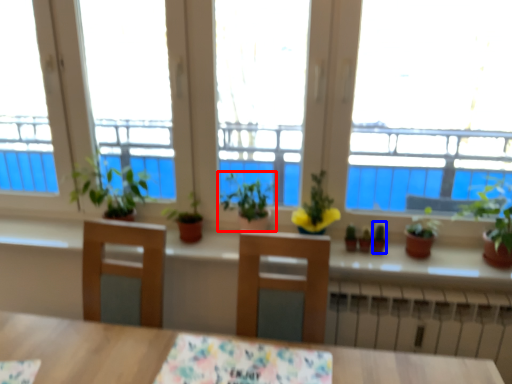
Question: Which point is further to the camera, houseplant (highlighted by a red box) or plant (highlighted by a blue box)?

Choices:
 (A) houseplant
 (B) plant

Answer: (B)